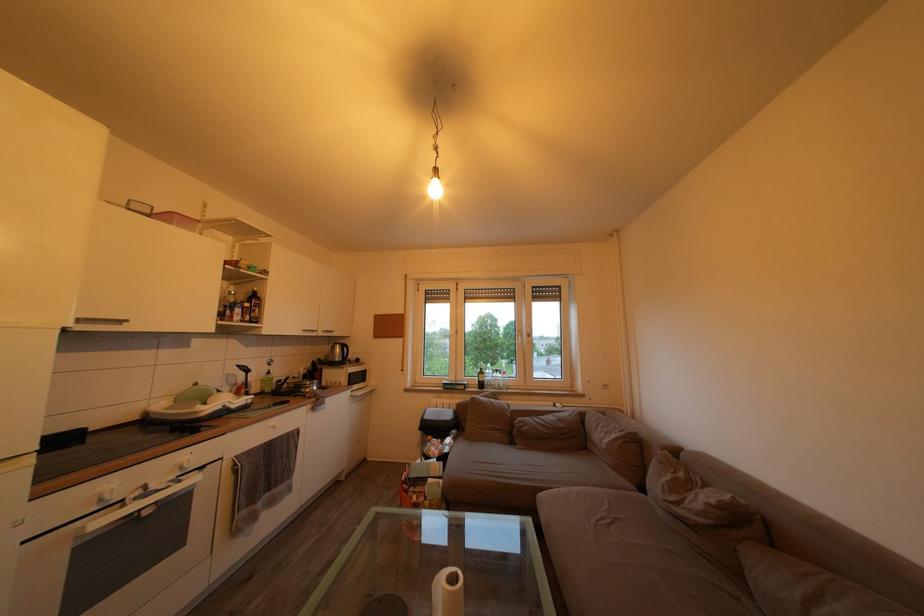
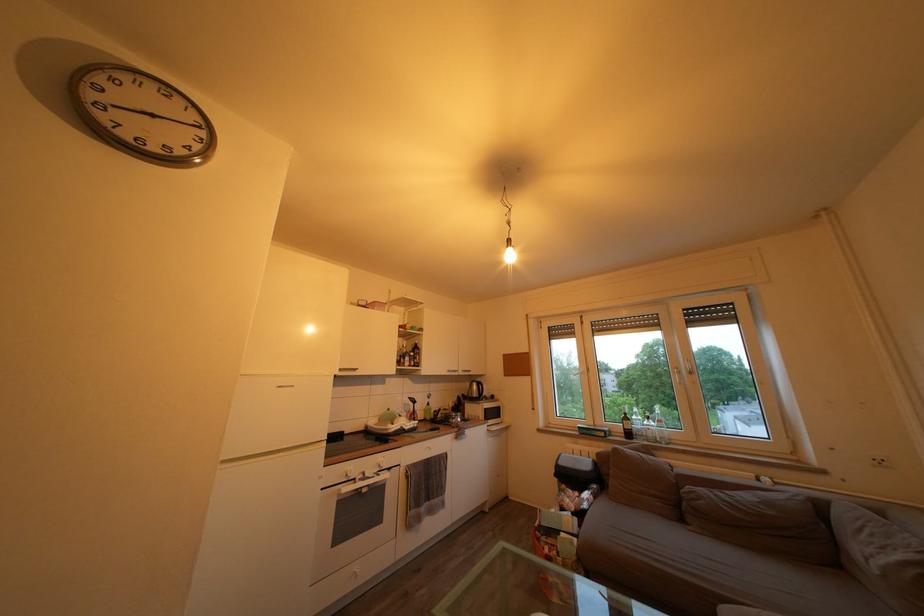
Question: The camera is either moving clockwise (left) or counter-clockwise (right) around the object. The first image is from the beginning of the video and the second image is from the end. Is the camera moving left or right when shooting the video?

Choices:
 (A) Left
 (B) Right

Answer: (B)